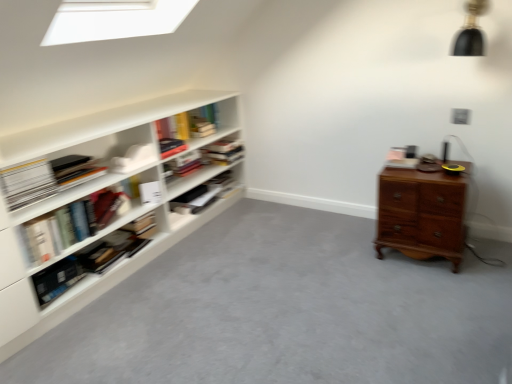
What do you see at coordinates (27, 183) in the screenshot?
I see `white matte book at left, marked as the 1th paperback book in a front-to-back arrangement` at bounding box center [27, 183].

Image resolution: width=512 pixels, height=384 pixels. What do you see at coordinates (470, 31) in the screenshot?
I see `black matte lampshade at upper right` at bounding box center [470, 31].

What is the approximate width of hardcover books at center, which ranks as the fifth book in bottom-to-top order?

It is 13.78 inches.

Where is `wooden chest of drawers at right`? This screenshot has height=384, width=512. wooden chest of drawers at right is located at coordinates (421, 214).

Find the location of a particular element. white matte book at left, acting as the 2th paperback book starting from the right is located at coordinates (27, 183).

Considering the positions of points (200, 94) and (210, 154), is point (200, 94) closer to camera compared to point (210, 154)?

Yes, it is in front of point (210, 154).

Measure the distance between white matte bookshelf at left, arranged as the second shelf when ordered from the bottom, and hardcover books at center, placed as the first book when sorted from top to bottom.

A distance of 27.91 inches exists between white matte bookshelf at left, arranged as the second shelf when ordered from the bottom, and hardcover books at center, placed as the first book when sorted from top to bottom.

In the image, is white matte bookshelf at left, which is the 1th shelf from top to bottom, positioned in front of or behind hardcover books at center, which ranks as the fifth book in bottom-to-top order?

white matte bookshelf at left, which is the 1th shelf from top to bottom, is in front of hardcover books at center, which ranks as the fifth book in bottom-to-top order.

Is white matte bookshelf at left, which is the 1th shelf from top to bottom, facing towards hardcover books at center, placed as the first book when sorted from top to bottom?

Yes, white matte bookshelf at left, which is the 1th shelf from top to bottom, is aimed at hardcover books at center, placed as the first book when sorted from top to bottom.

Are wooden chest of drawers at right and matte white bookshelf at center, which is the second shelf in top-to-bottom order, beside each other?

No, wooden chest of drawers at right is not making contact with matte white bookshelf at center, which is the second shelf in top-to-bottom order.

Considering the points (200, 310) and (180, 224), which point is behind, point (200, 310) or point (180, 224)?

The point (180, 224) is behind.

Is wooden chest of drawers at right shorter than matte white bookshelf at center, arranged as the 1th shelf when ordered from the bottom?

Yes.

Could you tell me if wooden chest of drawers at right is turned towards matte white bookshelf at center, which is the second shelf in top-to-bottom order?

A: No, wooden chest of drawers at right does not turn towards matte white bookshelf at center, which is the second shelf in top-to-bottom order.

Is hardcover book at upper left, which is the third book from top to bottom, aimed at hardcover books at center, placed as the first book when sorted from top to bottom?

No, hardcover book at upper left, which is the third book from top to bottom, does not turn towards hardcover books at center, placed as the first book when sorted from top to bottom.

Locate an element on the screen. The width and height of the screenshot is (512, 384). book behind the hardcover book at upper left, which ranks as the third book in bottom-to-top order is located at coordinates (223, 152).

From the image's perspective, which is above, hardcover book at upper left, which ranks as the third book in bottom-to-top order, or hardcover books at center, placed as the first book when sorted from top to bottom?

hardcover books at center, placed as the first book when sorted from top to bottom, appears higher in the image.

Does hardcover book at upper left, which ranks as the third book in bottom-to-top order, contain hardcover books at center, placed as the first book when sorted from top to bottom?

No, hardcover book at upper left, which ranks as the third book in bottom-to-top order, does not contain hardcover books at center, placed as the first book when sorted from top to bottom.

From the image's perspective, is white matte book at left, acting as the 2th paperback book starting from the right, below white matte bookshelf at left, arranged as the second shelf when ordered from the bottom?

No.

Does white matte book at left, positioned as the first paperback book in left-to-right order, turn towards white matte bookshelf at left, arranged as the second shelf when ordered from the bottom?

Yes, white matte book at left, positioned as the first paperback book in left-to-right order, is oriented towards white matte bookshelf at left, arranged as the second shelf when ordered from the bottom.

Is white matte bookshelf at left, which is the 1th shelf from top to bottom, inside white matte book at left, positioned as the first paperback book in left-to-right order?

No, white matte bookshelf at left, which is the 1th shelf from top to bottom, is not a part of white matte book at left, positioned as the first paperback book in left-to-right order.

In the scene shown: Is white matte book at left, acting as the 2th paperback book starting from the right, to the left of white matte bookshelf at left, which is the 1th shelf from top to bottom, from the viewer's perspective?

Correct, you'll find white matte book at left, acting as the 2th paperback book starting from the right, to the left of white matte bookshelf at left, which is the 1th shelf from top to bottom.

From the image's perspective, is hardcover book at center, marked as the second book in a top-to-bottom arrangement, located above or below white matte bookshelf at left, which is the 1th shelf from top to bottom?

From the image's perspective, hardcover book at center, marked as the second book in a top-to-bottom arrangement, appears above white matte bookshelf at left, which is the 1th shelf from top to bottom.

Is hardcover book at center, the 4th book positioned from the bottom, turned away from white matte bookshelf at left, which is the 1th shelf from top to bottom?

Yes, white matte bookshelf at left, which is the 1th shelf from top to bottom, is at the back of hardcover book at center, the 4th book positioned from the bottom.

In terms of size, does hardcover book at center, marked as the second book in a top-to-bottom arrangement, appear bigger or smaller than white matte bookshelf at left, which is the 1th shelf from top to bottom?

A: In the image, hardcover book at center, marked as the second book in a top-to-bottom arrangement, appears to be smaller than white matte bookshelf at left, which is the 1th shelf from top to bottom.

Would you say hardcover book at center, marked as the second book in a top-to-bottom arrangement, is to the left or to the right of white matte bookshelf at left, arranged as the second shelf when ordered from the bottom, in the picture?

hardcover book at center, marked as the second book in a top-to-bottom arrangement, is to the right of white matte bookshelf at left, arranged as the second shelf when ordered from the bottom.

From the image's perspective, would you say wooden chest of drawers at right is shown under hardcover book at left, marked as the 1th book in a bottom-to-top arrangement?

No.

Is wooden chest of drawers at right closer to camera compared to hardcover book at left, the fifth book in the top-to-bottom sequence?

Yes, wooden chest of drawers at right is closer to the viewer.

Is wooden chest of drawers at right turned away from hardcover book at left, marked as the 1th book in a bottom-to-top arrangement?

wooden chest of drawers at right does not have its back to hardcover book at left, marked as the 1th book in a bottom-to-top arrangement.

What are the coordinates of `the chest of drawers lying above the hardcover book at left, the fifth book in the top-to-bottom sequence (from the image's perspective)` in the screenshot? It's located at (421, 214).

Which is closer, (46, 178) or (84, 256)?

Point (46, 178) is closer to the camera than point (84, 256).

Could you tell me if white matte book at left, marked as the 1th paperback book in a front-to-back arrangement, is facing hardcover book at left, marked as the 1th book in a bottom-to-top arrangement?

No.

Who is shorter, white matte book at left, acting as the 2th paperback book starting from the right, or hardcover book at left, the fifth book in the top-to-bottom sequence?

hardcover book at left, the fifth book in the top-to-bottom sequence, is shorter.

How many degrees apart are the facing directions of white matte book at left, marked as the 1th paperback book in a front-to-back arrangement, and hardcover book at left, the fifth book in the top-to-bottom sequence?

8.41 degrees separate the facing orientations of white matte book at left, marked as the 1th paperback book in a front-to-back arrangement, and hardcover book at left, the fifth book in the top-to-bottom sequence.

You are a GUI agent. You are given a task and a screenshot of the screen. Output one action in this format:
    pyautogui.click(x=<x>, y=<y>)
    Task: Click on the 2nd shelf counting from the left of the hardcover books at center, which ranks as the fifth book in bottom-to-top order
    Image resolution: width=512 pixels, height=384 pixels.
    Given the screenshot: What is the action you would take?
    pyautogui.click(x=97, y=200)

This screenshot has height=384, width=512. In order to click on concrete in front of the matte white bookshelf at center, arranged as the 1th shelf when ordered from the bottom in this screenshot , I will do `click(285, 311)`.

From the image, which object appears to be farther from black matte lampshade at upper right, hardcover book at left, positioned as the fourth book in top-to-bottom order, or wooden chest of drawers at right?

Based on the image, hardcover book at left, positioned as the fourth book in top-to-bottom order, appears to be further to black matte lampshade at upper right.

Considering their positions, is white matte bookshelf at left, which is the 1th shelf from top to bottom, positioned further to matte white bookshelf at center, arranged as the 1th shelf when ordered from the bottom, than white matte paperback book at left, positioned as the 2th paperback book in left-to-right order?

Among the two, white matte paperback book at left, positioned as the 2th paperback book in left-to-right order, is located further to matte white bookshelf at center, arranged as the 1th shelf when ordered from the bottom.

Based on their spatial positions, is hardcover book at left, the fifth book in the top-to-bottom sequence, or white matte book at left, acting as the 2th paperback book starting from the right, further from hardcover books at center, placed as the first book when sorted from top to bottom?

white matte book at left, acting as the 2th paperback book starting from the right, is further to hardcover books at center, placed as the first book when sorted from top to bottom.

Based on the photo, based on their spatial positions, is white matte bookshelf at left, arranged as the second shelf when ordered from the bottom, or hardcover books at center, placed as the first book when sorted from top to bottom, closer to hardcover book at upper left, which ranks as the third book in bottom-to-top order?

hardcover books at center, placed as the first book when sorted from top to bottom, lies closer to hardcover book at upper left, which ranks as the third book in bottom-to-top order, than the other object.

When comparing their distances from matte white bookshelf at center, which is the second shelf in top-to-bottom order, does hardcover book at left, the fifth book in the top-to-bottom sequence, or white matte bookshelf at left, arranged as the second shelf when ordered from the bottom, seem further?

The object further to matte white bookshelf at center, which is the second shelf in top-to-bottom order, is hardcover book at left, the fifth book in the top-to-bottom sequence.

Based on their spatial positions, is black matte lampshade at upper right or wooden chest of drawers at right closer to white matte paperback book at left, which ranks as the first paperback book in right-to-left order?

wooden chest of drawers at right.

From the image, which object appears to be nearer to hardcover books at center, placed as the first book when sorted from top to bottom, wooden chest of drawers at right or hardcover book at center, marked as the second book in a top-to-bottom arrangement?

Based on the image, hardcover book at center, marked as the second book in a top-to-bottom arrangement, appears to be nearer to hardcover books at center, placed as the first book when sorted from top to bottom.

Based on their spatial positions, is hardcover books at center, which ranks as the fifth book in bottom-to-top order, or hardcover book at left, the fifth book in the top-to-bottom sequence, further from hardcover book at upper left, which ranks as the third book in bottom-to-top order?

hardcover book at left, the fifth book in the top-to-bottom sequence, is further to hardcover book at upper left, which ranks as the third book in bottom-to-top order.

The height and width of the screenshot is (384, 512). Identify the location of shelf positioned between hardcover book at center, the 4th book positioned from the bottom, and hardcover book at upper left, which is the third book from top to bottom, from near to far. (201, 198).

Locate an element on the screen. This screenshot has height=384, width=512. shelf positioned between wooden chest of drawers at right and matte white bookshelf at center, arranged as the 1th shelf when ordered from the bottom, from near to far is located at coordinates (97, 200).

Locate an element on the screen. This screenshot has height=384, width=512. shelf positioned between white matte bookshelf at left, which is the 1th shelf from top to bottom, and hardcover book at upper left, which ranks as the third book in bottom-to-top order, from near to far is located at coordinates (201, 198).

Image resolution: width=512 pixels, height=384 pixels. Find the location of `shelf situated between hardcover book at upper left, which ranks as the third book in bottom-to-top order, and wooden chest of drawers at right from left to right`. shelf situated between hardcover book at upper left, which ranks as the third book in bottom-to-top order, and wooden chest of drawers at right from left to right is located at coordinates (201, 198).